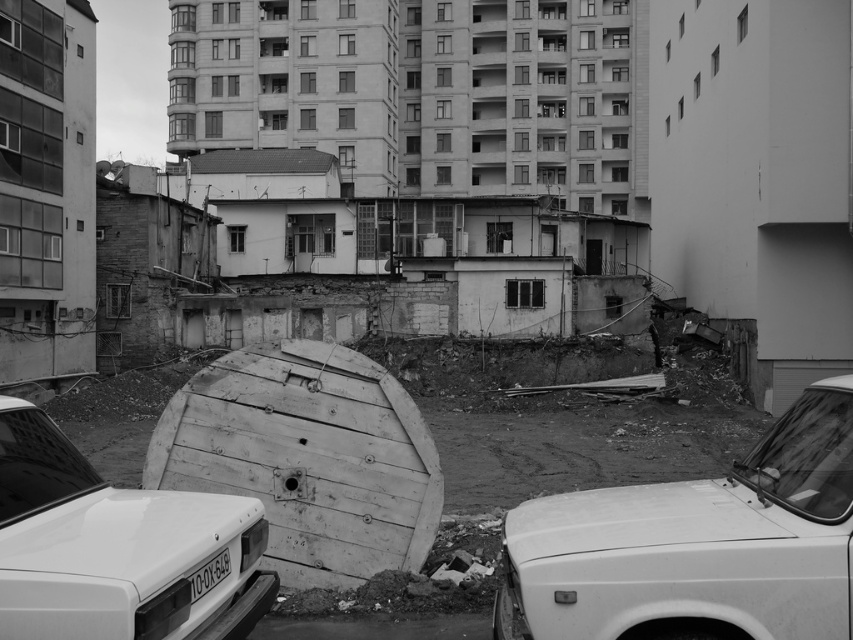
You are a delivery driver who needs to navigate through this urban area. You see the wooden barrel at center and the white matte car at center. Which object is closer to you, the delivery driver?

The wooden barrel at center is closer to you because it is further to the viewer than the white matte car at center.

You are a delivery driver trying to navigate through the urban scene shown. You need to pass between the wooden barrel at center and the white matte car at center. Can your delivery van, which is 1.8 meters wide, fit through the space between them?

The wooden barrel at center might be wider than the white matte car at center, so the space between them may not be wide enough for a 1.8 meter wide delivery van. It is uncertain and risky to attempt passing through without more precise measurements.

You are standing at the center of the scene and want to locate the white matte car at lower right. Based on the coordinates provided, in which direction should you look to find it?

The white matte car at lower right is located at coordinates point (697, 545), which is to the lower right from the center of the scene. Therefore, you should look towards the lower right direction to find it.